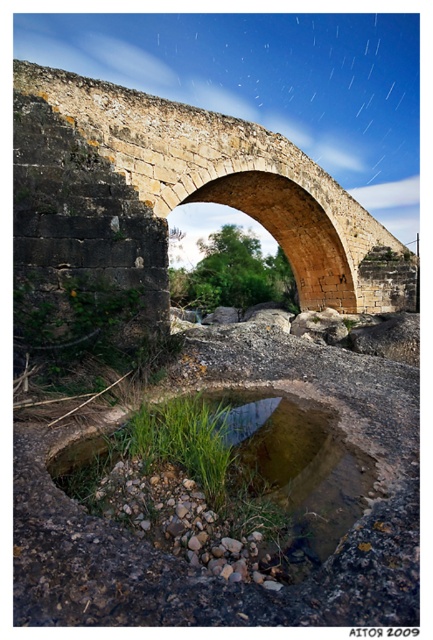
Question: Does yellowish stone bridge at center lie in front of clear water at center?

Choices:
 (A) no
 (B) yes

Answer: (A)

Question: Does yellowish stone bridge at center have a lesser width compared to clear water at center?

Choices:
 (A) no
 (B) yes

Answer: (A)

Question: Which point is farther to the camera?

Choices:
 (A) clear water at center
 (B) yellowish stone bridge at center

Answer: (B)

Question: Which point appears farthest from the camera in this image?

Choices:
 (A) coord(71,116)
 (B) coord(96,465)

Answer: (A)

Question: Is yellowish stone bridge at center to the left of clear water at center from the viewer's perspective?

Choices:
 (A) yes
 (B) no

Answer: (B)